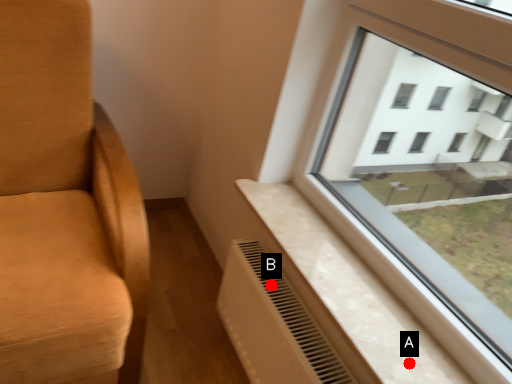
Question: Two points are circled on the image, labeled by A and B beside each circle. Which point is farther from the camera taking this photo?

Choices:
 (A) A is further
 (B) B is further

Answer: (B)